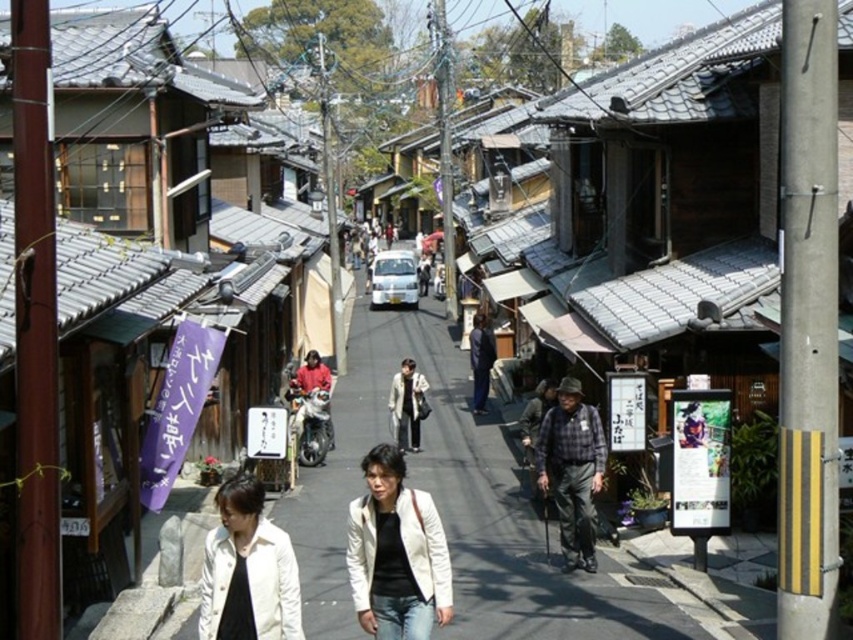
Question: Where is white leather jacket at center located in relation to plaid fabric hat at center in the image?

Choices:
 (A) right
 (B) left

Answer: (B)

Question: Which of these objects is positioned farthest from the dark blue jeans at center?

Choices:
 (A) white matte jacket at lower center
 (B) light beige jacket at center
 (C) plaid fabric hat at center
 (D) shiny silver motorcycle at center

Answer: (A)

Question: Estimate the real-world distances between objects in this image. Which object is closer to the white matte jacket at lower center?

Choices:
 (A) white leather jacket at center
 (B) dark blue jeans at center
 (C) plaid fabric hat at center

Answer: (A)

Question: Among these objects, which one is farthest from the camera?

Choices:
 (A) smooth asphalt road at center
 (B) dark blue jeans at center
 (C) white leather jacket at center
 (D) white matte jacket at lower center

Answer: (B)

Question: Does white matte jacket at lower center come behind light beige jacket at center?

Choices:
 (A) no
 (B) yes

Answer: (A)

Question: Can you confirm if light beige jacket at center is positioned to the left of dark blue jeans at center?

Choices:
 (A) no
 (B) yes

Answer: (B)